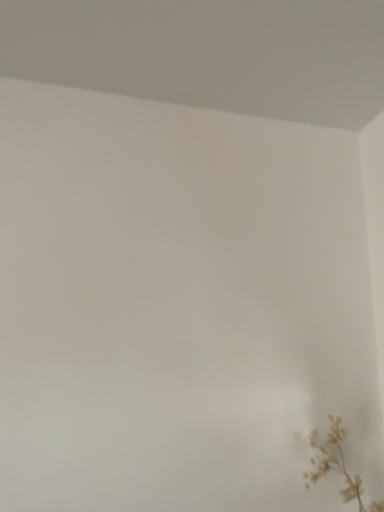
The height and width of the screenshot is (512, 384). Describe the element at coordinates (336, 465) in the screenshot. I see `white fluffy flower at lower right` at that location.

This screenshot has height=512, width=384. I want to click on white fluffy flower at lower right, so click(336, 465).

In order to face white fluffy flower at lower right, should I rotate leftwards or rightwards?

You should look right and rotate roughly 20.634 degrees.

Measure the distance between point (355, 485) and camera.

The depth of point (355, 485) is 1.30 meters.

Where is `white fluffy flower at lower right`? This screenshot has width=384, height=512. white fluffy flower at lower right is located at coordinates (336, 465).